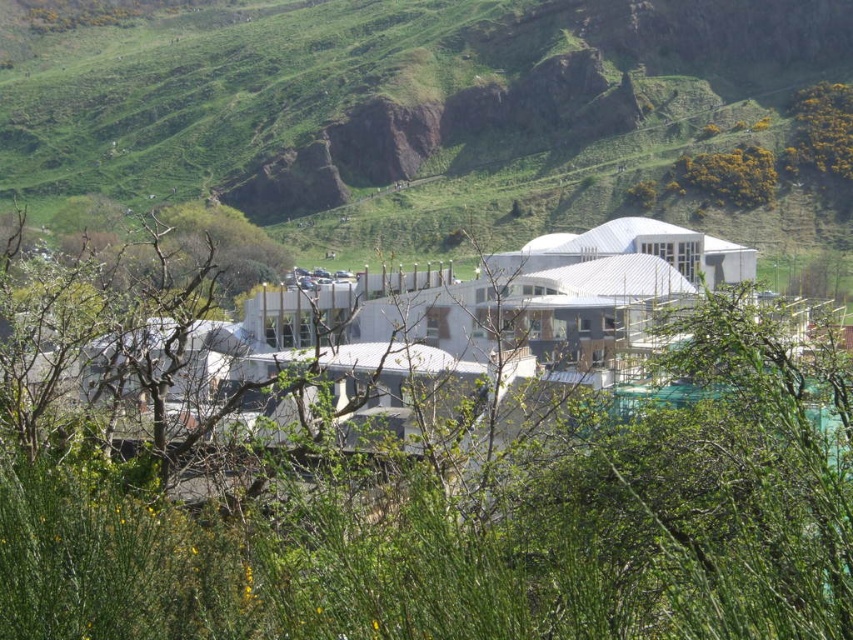
Which is above, green leafy shrubs at center or green grassy hillside at center?

green grassy hillside at center

Does green leafy shrubs at center have a greater width compared to green grassy hillside at center?

Incorrect, green leafy shrubs at center's width does not surpass green grassy hillside at center's.

Is point (579, 284) farther from camera compared to point (761, 112)?

No, (579, 284) is closer to viewer.

I want to click on green leafy shrubs at center, so click(x=422, y=470).